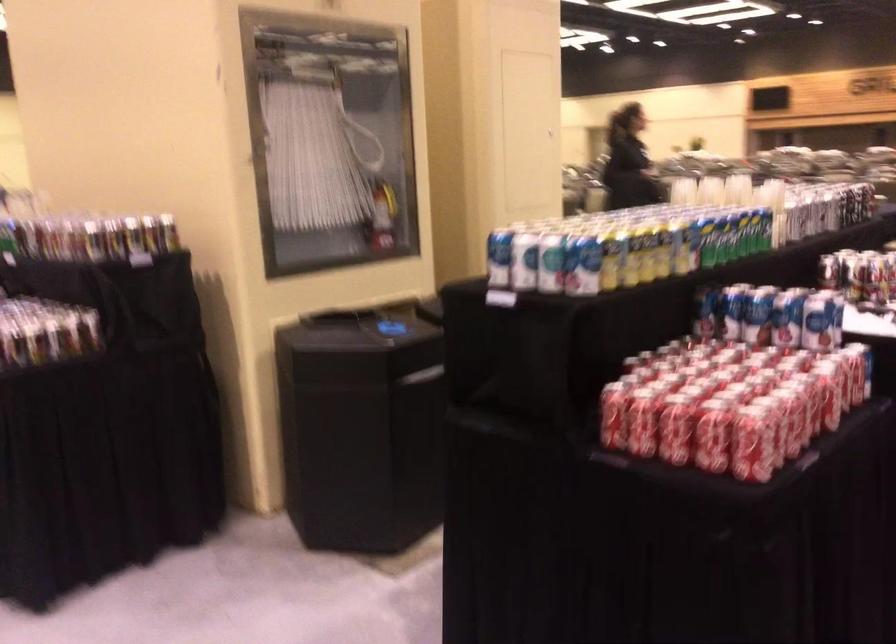
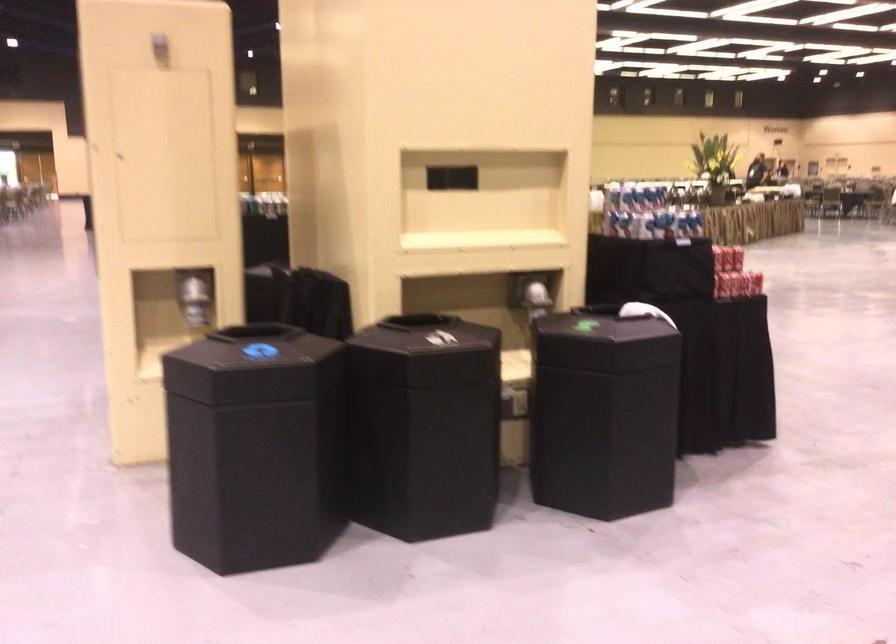
Question: I am providing you with two images of the same scene from different viewpoints. Please identify which objects are invisible in image2.

Choices:
 (A) black bin lid
 (B) shiny dispenser lever
 (C) clear cabinet handle
 (D) blue and white can

Answer: (D)